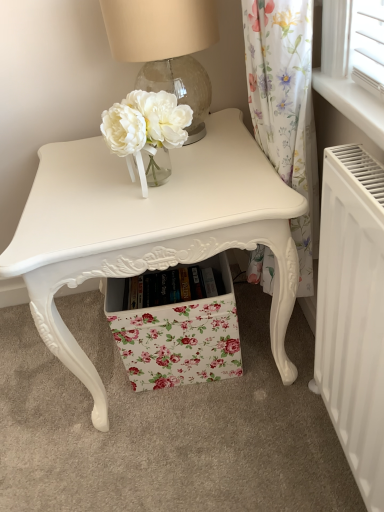
Identify the location of vacant space in front of translucent glass table lamp at upper center. Image resolution: width=384 pixels, height=512 pixels. (205, 168).